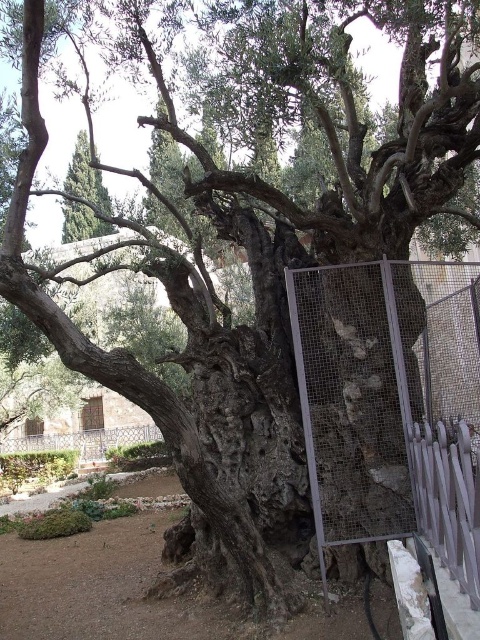
In the scene shown: You are a visitor standing at the entrance of the garden and want to take a photo of the ancient olive tree. The metal mesh fence at center and the wrought iron fence at lower left are in your way. Which fence do you need to move closer to in order to frame the tree better?

The metal mesh fence at center is in front of the wrought iron fence at lower left. To frame the ancient olive tree better, you should move closer to the metal mesh fence at center so it is between you and the tree, allowing the wrought iron fence at lower left to be less obstructive in the background.

You are a visitor standing at the entrance of the olive grove and want to touch the green rough textured tree at upper left. Can you reach it without going through the white metal fence at right?

The white metal fence at right is in front of the green rough textured tree at upper left, so you cannot reach the tree without passing through the fence.

Looking at this image, you are a visitor standing at the entrance of the area and want to take a photo of the metal mesh fence at center and the green rough textured tree at upper left. Which object will appear taller in the photo?

The green rough textured tree at upper left will appear taller in the photo because the metal mesh fence at center has a lesser height compared to it.